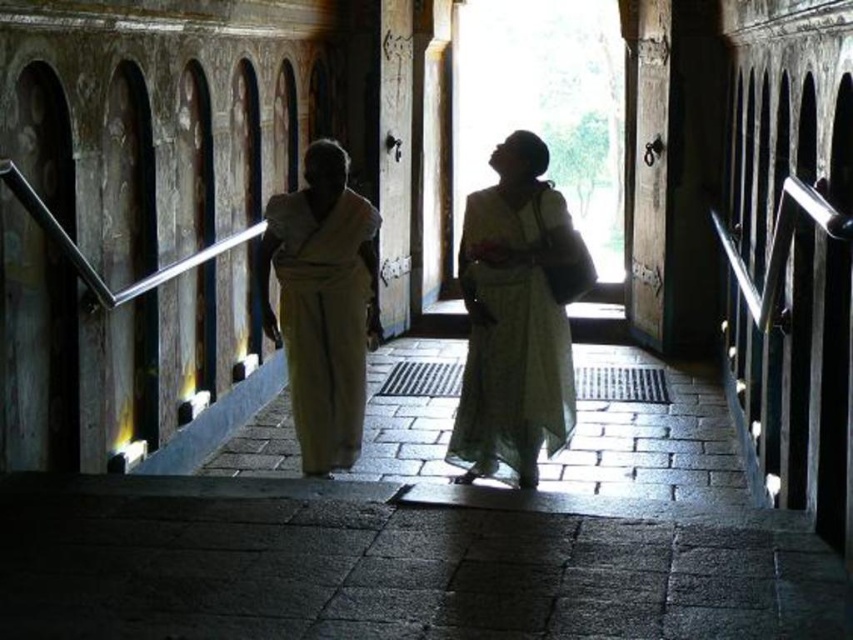
You are standing in the corridor of the temple and see the white sheer dress at center and the light beige fabric monk at center. Which one is positioned more to the right side of the corridor?

The white sheer dress at center is positioned to the right of the light beige fabric monk at center, so the white sheer dress at center is more to the right side of the corridor.

You are standing in the corridor of a historical building and see two people in front of you. One is wearing a white sheer dress at center and the other is a light beige fabric monk at center. Which one is shorter?

The white sheer dress at center is not as tall as the light beige fabric monk at center, so the person wearing the white sheer dress at center is shorter.